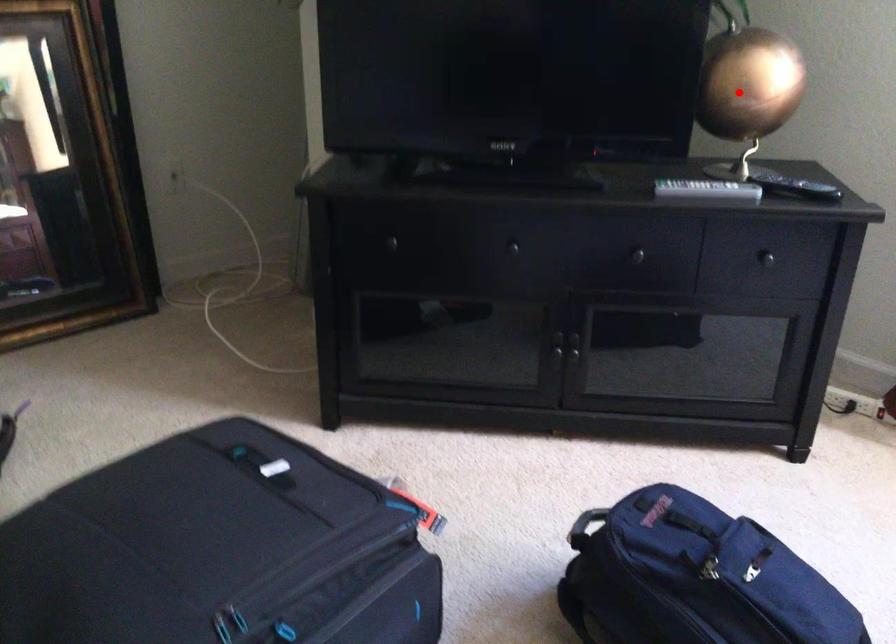
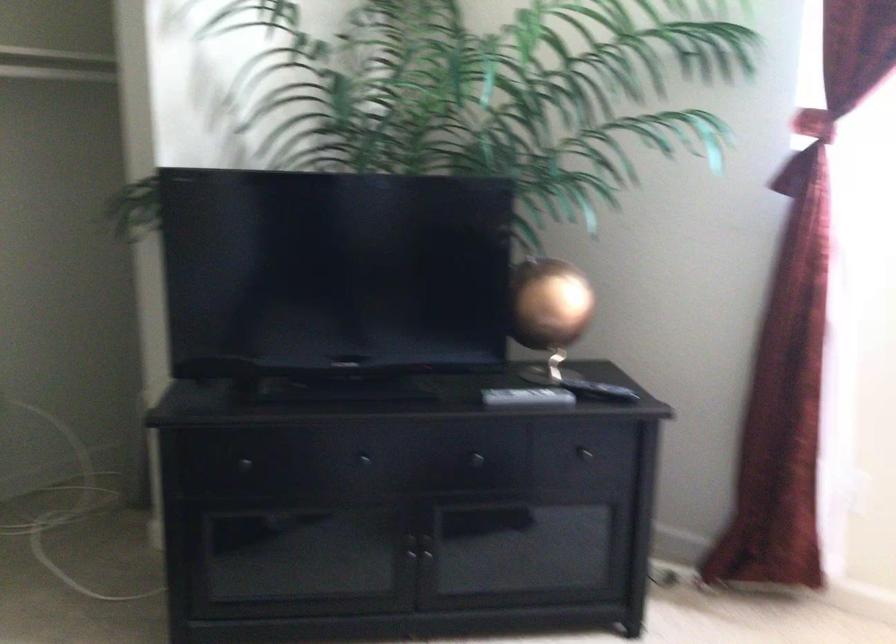
Find the pixel in the second image that matches the highlighted location in the first image.

(548, 310)